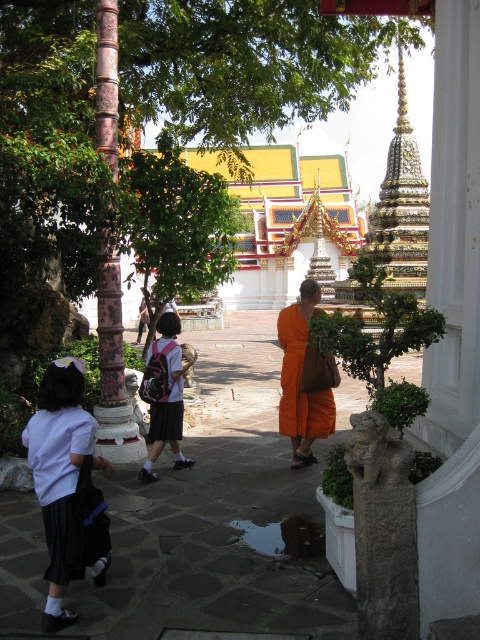
You are a visitor at the temple and want to place a small offering on the orange cloth at center. However, there is a matte orange robe at center nearby. Which object should you place the offering on if you want it to be closer to the temple structure in the background?

The orange cloth at center is to the right of the matte orange robe at center. Since the temple structure is in the background, placing the offering on the orange cloth at center would position it closer to the temple structure as it is further along the pathway leading towards it.

You are a photographer planning to take a picture of the temple. You notice the white fabric skirt at lower left and the matte orange robe at center in your frame. Which object should you adjust your camera angle to avoid covering the temple structure in the background?

The white fabric skirt at lower left is larger in size than the matte orange robe at center, so you should adjust your camera angle to avoid covering the temple structure in the background by moving the white fabric skirt at lower left out of the frame.

You are a visitor at the temple and want to take a photo of the white fabric skirt at lower left and the matte orange robe at center. Which object should you focus on first if you want to capture both in one shot without moving the camera?

The white fabric skirt at lower left has a greater height compared to the matte orange robe at center, so you should focus on the white fabric skirt at lower left first to ensure both are in frame.